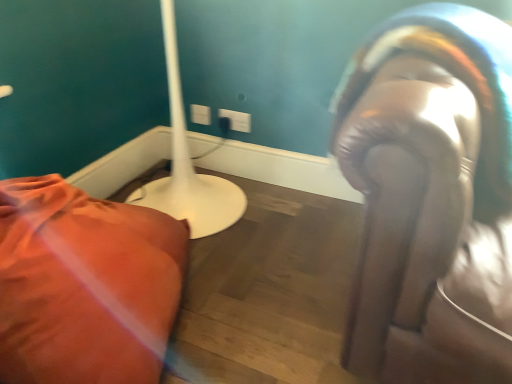
Question: From a real-world perspective, is white plastic electric outlet at upper center, marked as the second electric outlet in a left-to-right arrangement, on top of matte white lamp at left?

Choices:
 (A) no
 (B) yes

Answer: (B)

Question: Is white plastic electric outlet at upper center, marked as the second electric outlet in a left-to-right arrangement, to the right of matte white lamp at left from the viewer's perspective?

Choices:
 (A) yes
 (B) no

Answer: (A)

Question: Is white plastic electric outlet at upper center, which appears as the 1th electric outlet when viewed from the right, bigger than matte white lamp at left?

Choices:
 (A) no
 (B) yes

Answer: (A)

Question: Is white plastic electric outlet at upper center, marked as the second electric outlet in a left-to-right arrangement, thinner than matte white lamp at left?

Choices:
 (A) no
 (B) yes

Answer: (B)

Question: Is white plastic electric outlet at upper center, which appears as the 1th electric outlet when viewed from the right, surrounding matte white lamp at left?

Choices:
 (A) yes
 (B) no

Answer: (B)

Question: From a real-world perspective, is white plastic electric outlet at upper center, which appears as the 1th electric outlet when viewed from the right, positioned under matte white lamp at left based on gravity?

Choices:
 (A) no
 (B) yes

Answer: (A)

Question: Is white plastic electric outlet at upper center, which appears as the 2th electric outlet when viewed from the right, positioned before matte white lamp at left?

Choices:
 (A) no
 (B) yes

Answer: (A)

Question: Considering the relative positions of white plastic electric outlet at upper center, which appears as the first electric outlet when viewed from the left, and matte white lamp at left in the image provided, is white plastic electric outlet at upper center, which appears as the first electric outlet when viewed from the left, behind matte white lamp at left?

Choices:
 (A) no
 (B) yes

Answer: (B)

Question: Is white plastic electric outlet at upper center, which appears as the first electric outlet when viewed from the left, at the right side of matte white lamp at left?

Choices:
 (A) no
 (B) yes

Answer: (B)

Question: From the image's perspective, is white plastic electric outlet at upper center, which appears as the first electric outlet when viewed from the left, on matte white lamp at left?

Choices:
 (A) yes
 (B) no

Answer: (A)

Question: From the image's perspective, is white plastic electric outlet at upper center, which appears as the first electric outlet when viewed from the left, located beneath matte white lamp at left?

Choices:
 (A) no
 (B) yes

Answer: (A)

Question: From a real-world perspective, does white plastic electric outlet at upper center, which appears as the 2th electric outlet when viewed from the right, sit lower than matte white lamp at left?

Choices:
 (A) yes
 (B) no

Answer: (B)

Question: Is matte white lamp at left not near white plastic electric outlet at upper center, which appears as the 1th electric outlet when viewed from the right?

Choices:
 (A) no
 (B) yes

Answer: (A)